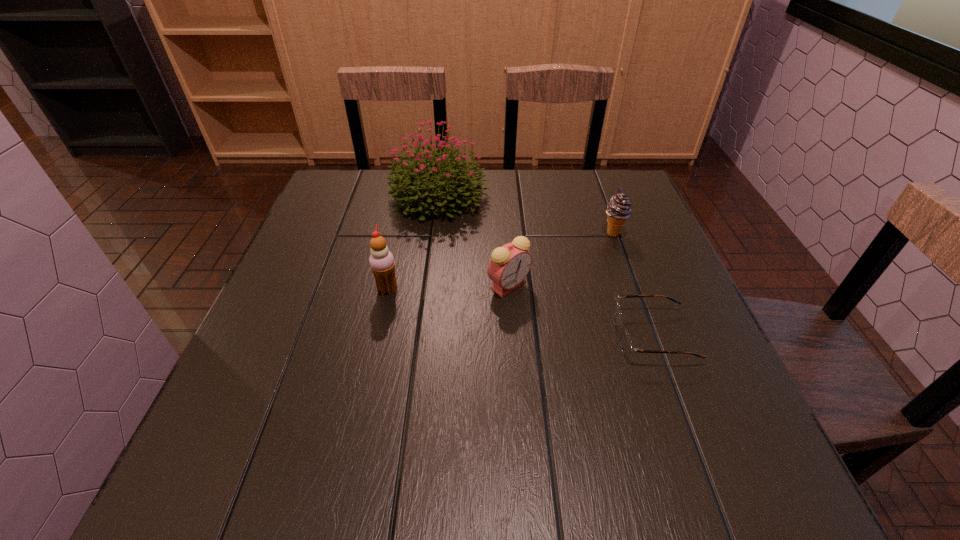
You are a GUI agent. You are given a task and a screenshot of the screen. Output one action in this format:
    pyautogui.click(x=<x>, y=<y>)
    Task: Click on the tallest object
    The image size is (960, 540).
    Given the screenshot: What is the action you would take?
    pyautogui.click(x=413, y=183)

You are a GUI agent. You are given a task and a screenshot of the screen. Output one action in this format:
    pyautogui.click(x=<x>, y=<y>)
    Task: Click on the farthest object
    The image size is (960, 540).
    Given the screenshot: What is the action you would take?
    pyautogui.click(x=413, y=183)

Where is `the left icecream`? The image size is (960, 540). the left icecream is located at coordinates (381, 260).

The height and width of the screenshot is (540, 960). What are the coordinates of `the fourth shortest object` in the screenshot? It's located at (381, 260).

What are the coordinates of `the shorter icecream` in the screenshot? It's located at (618, 210).

The height and width of the screenshot is (540, 960). In order to click on the farther icecream in this screenshot , I will do `click(618, 210)`.

Identify the location of alarm clock. Image resolution: width=960 pixels, height=540 pixels. (509, 265).

Identify the location of spectacles. (627, 347).

I want to click on the shortest object, so click(627, 347).

Locate an element on the screen. The image size is (960, 540). free region located on the right of the tallest object is located at coordinates (540, 195).